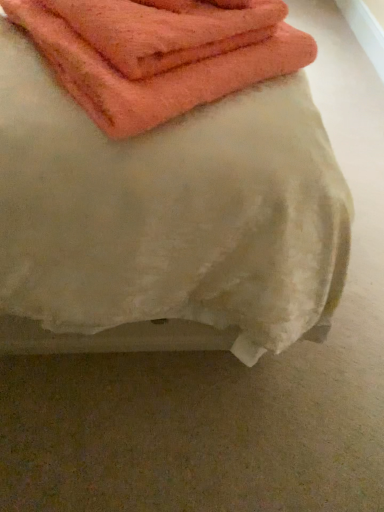
Question: Considering the positions of orange terry cloth towel at upper left, acting as the 1th towel starting from the back, and orange terry cloth towel at upper left, the 2th towel from the back, in the image, is orange terry cloth towel at upper left, acting as the 1th towel starting from the back, wider or thinner than orange terry cloth towel at upper left, the 2th towel from the back,?

Choices:
 (A) thin
 (B) wide

Answer: (A)

Question: Which is correct: orange terry cloth towel at upper left, the third towel from the front, is inside orange terry cloth towel at upper left, the 2th towel from the back, or outside of it?

Choices:
 (A) outside
 (B) inside

Answer: (B)

Question: Which is nearer to the orange cotton towel at upper left, which is the first towel in front-to-back order?

Choices:
 (A) orange terry cloth towel at upper left, the 2th towel from the back
 (B) orange terry cloth towel at upper left, the third towel from the front

Answer: (A)

Question: Which of these objects is positioned closest to the orange terry cloth towel at upper left, acting as the 1th towel starting from the back?

Choices:
 (A) orange cotton towel at upper left, the third towel when ordered from back to front
 (B) orange terry cloth towel at upper left, the 2th towel from the back

Answer: (B)